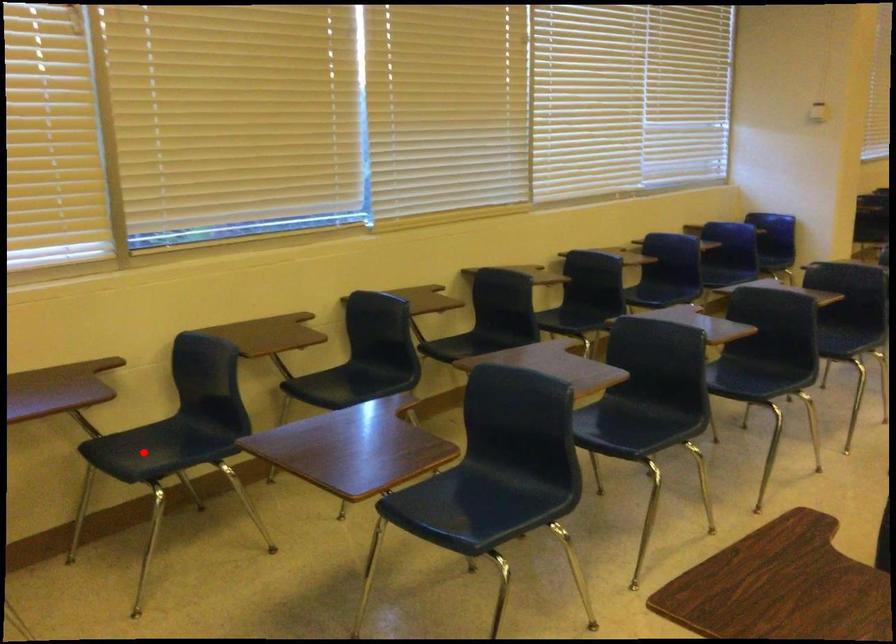
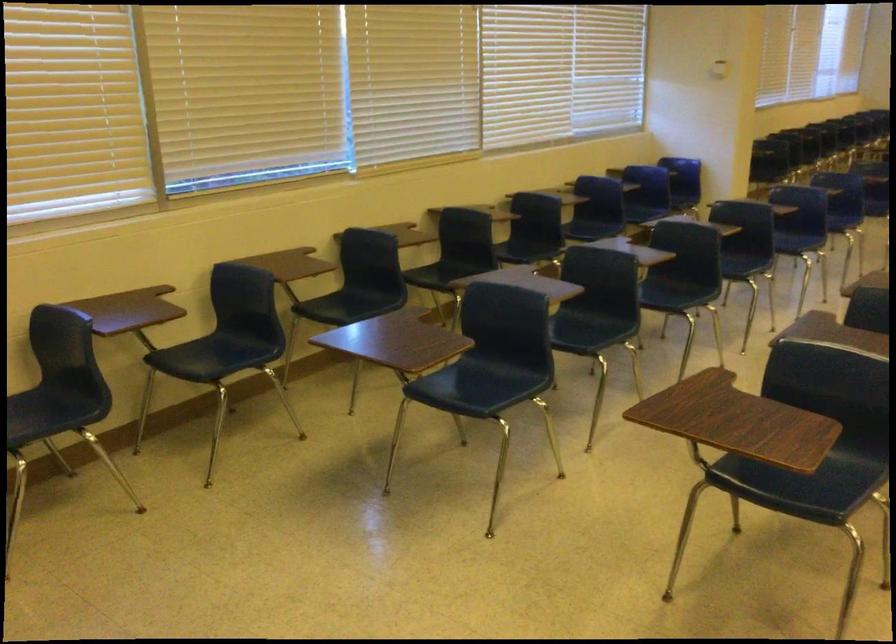
Question: I am providing you with two images of the same scene from different viewpoints. A red point is marked on the first image. Can you still see the location of the red point in image 2?

Choices:
 (A) Yes
 (B) No

Answer: (A)